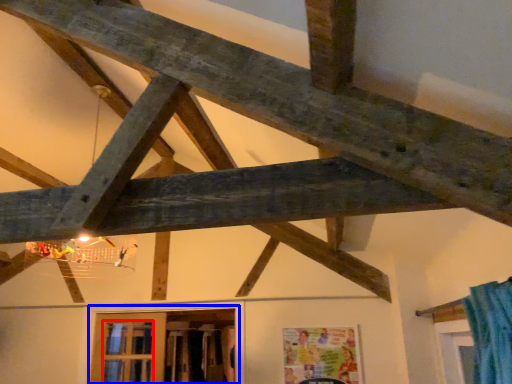
Question: Which object appears closest to the camera in this image, window (highlighted by a red box) or window (highlighted by a blue box)?

Choices:
 (A) window
 (B) window

Answer: (B)